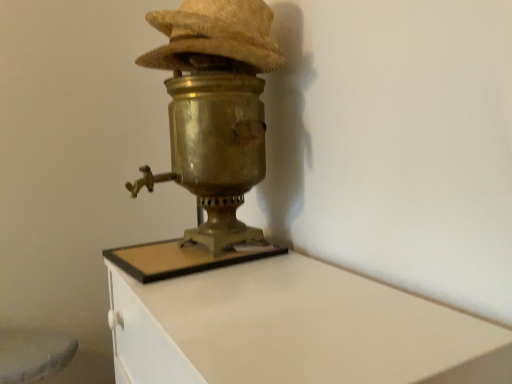
At what (x,y) coordinates should I click in order to perform the action: click on free location in front of brass/bronze table lamp at center. Please return your answer as a coordinate pair (x, y). This screenshot has width=512, height=384. Looking at the image, I should click on (x=220, y=287).